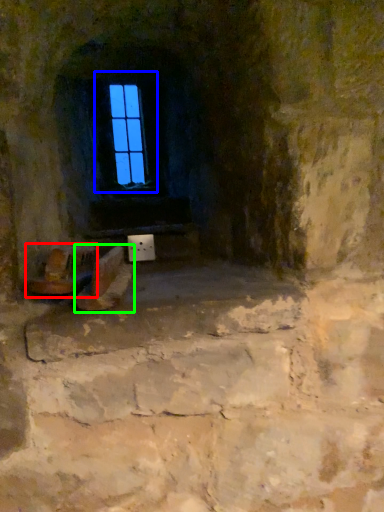
Question: Considering the real-world distances, which object is farthest from chair (highlighted by a red box)? window (highlighted by a blue box) or footwear (highlighted by a green box)?

Choices:
 (A) window
 (B) footwear

Answer: (A)